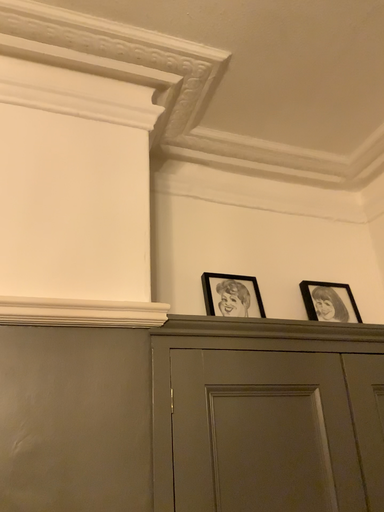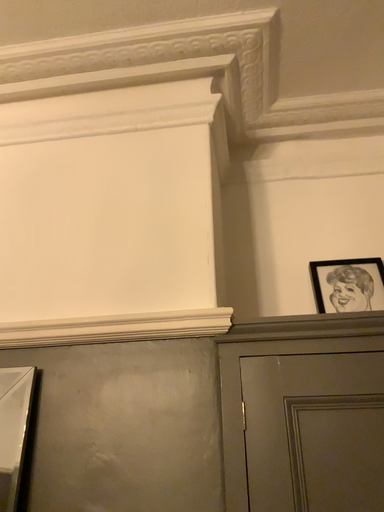
Question: How did the camera likely rotate when shooting the video?

Choices:
 (A) rotated left
 (B) rotated right

Answer: (A)